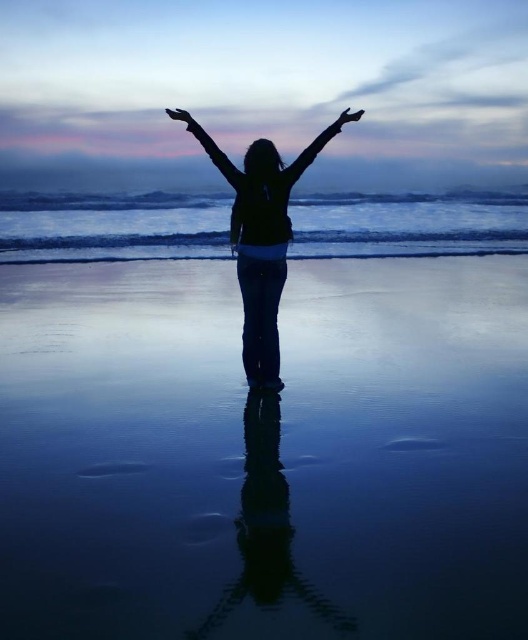
You are a photographer trying to capture the reflection of the person in the image. You notice the clear blue water at center and the smooth black hand at upper center. Which object is closer to you, the photographer, and why?

The smooth black hand at upper center is closer to you because the clear blue water at center is further away, as indicated by its position behind the hand.